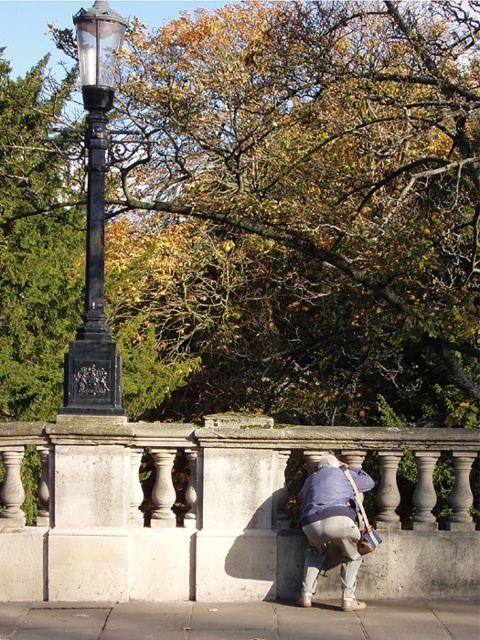
Question: Which object is positioned closest to the black polished metal pole at left?

Choices:
 (A) green leafy tree at upper center
 (B) white stone balustrade at center
 (C) light blue fabric at lower center
 (D) black wrought iron lamp post at left

Answer: (D)

Question: Which of the following is the farthest from the observer?

Choices:
 (A) (324, 484)
 (B) (382, 52)
 (C) (84, 362)
 (D) (210, 541)

Answer: (B)

Question: Is black polished metal pole at left positioned at the back of light blue fabric at lower center?

Choices:
 (A) yes
 (B) no

Answer: (A)

Question: Can you confirm if white stone balustrade at center is wider than light blue fabric at lower center?

Choices:
 (A) yes
 (B) no

Answer: (A)

Question: Does white stone balustrade at center have a lesser width compared to light blue fabric at lower center?

Choices:
 (A) no
 (B) yes

Answer: (A)

Question: Which point is farther to the camera?

Choices:
 (A) green leafy tree at upper center
 (B) black wrought iron lamp post at left
 (C) white stone balustrade at center
 (D) light blue fabric at lower center

Answer: (A)